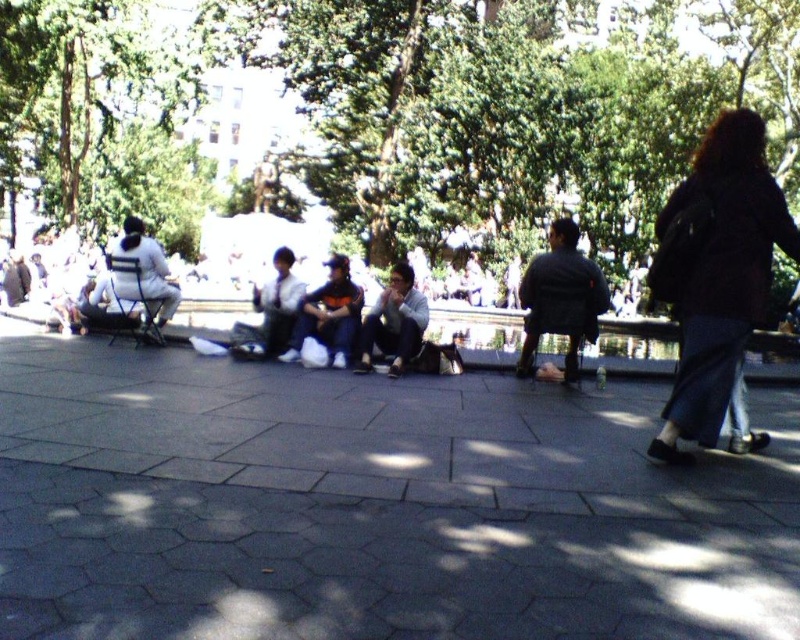
Can you confirm if gray concrete pavement at center is positioned to the right of matte black jacket at center?

Indeed, gray concrete pavement at center is positioned on the right side of matte black jacket at center.

Is point (770, 474) more distant than point (244, 342)?

That is False.

Find the location of a particular element. The height and width of the screenshot is (640, 800). gray concrete pavement at center is located at coordinates (370, 506).

Does dark gray jacket at center have a greater width compared to matte black jacket at center?

Indeed, dark gray jacket at center has a greater width compared to matte black jacket at center.

This screenshot has width=800, height=640. What do you see at coordinates (560, 298) in the screenshot?
I see `dark gray jacket at center` at bounding box center [560, 298].

Where is `dark gray jacket at center`? This screenshot has width=800, height=640. dark gray jacket at center is located at coordinates (560, 298).

Does gray concrete pavement at center have a greater width compared to light gray fabric jacket at center?

Correct, the width of gray concrete pavement at center exceeds that of light gray fabric jacket at center.

Does point (270, 637) lie behind point (408, 321)?

No, it is in front of (408, 321).

Locate an element on the screen. gray concrete pavement at center is located at coordinates (370, 506).